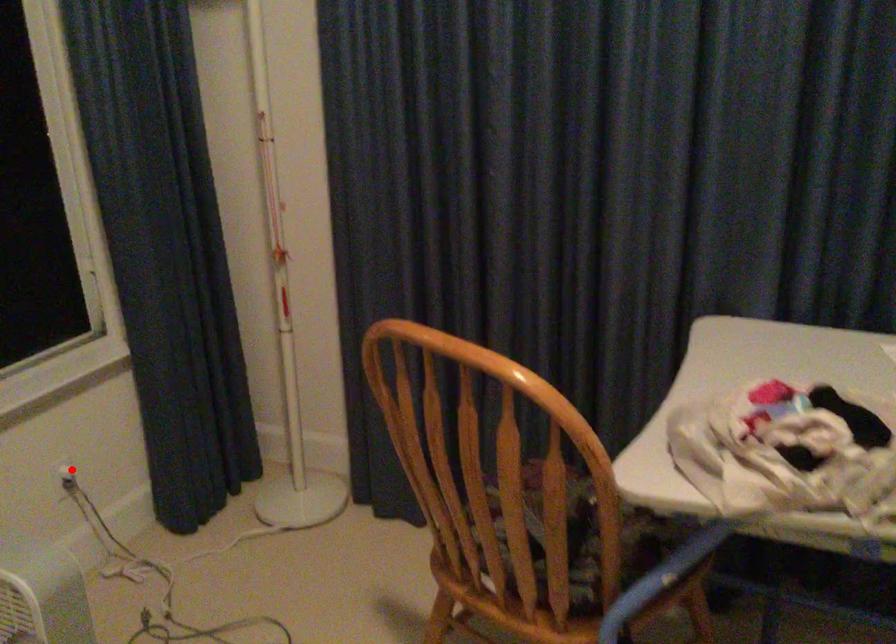
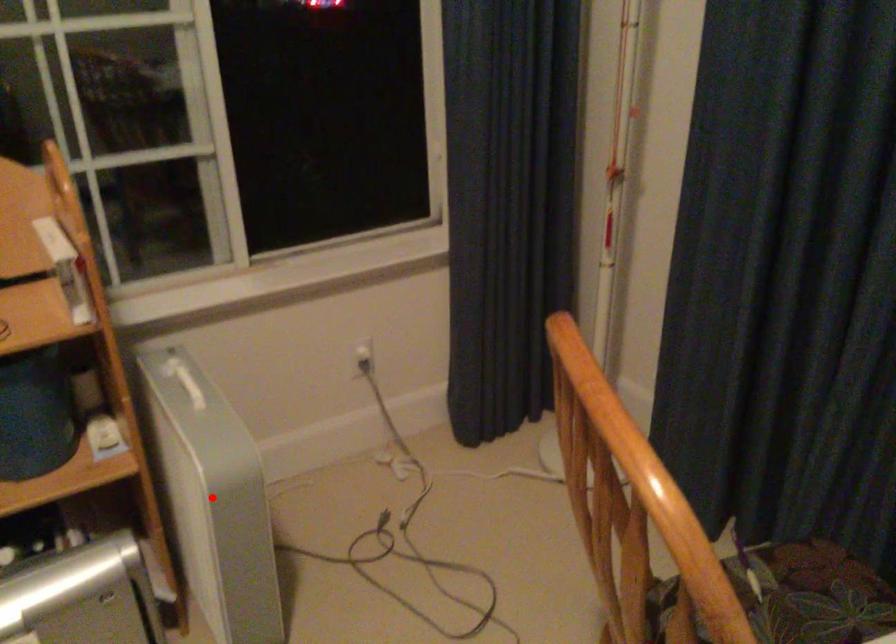
I am providing you with two images of the same scene from different viewpoints. A red point is marked on the first image and another point is marked on the second image. Are the points marked in image1 and image2 representing the same 3D position?

No